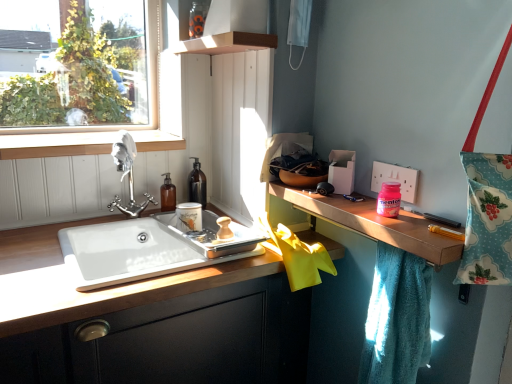
Where is `wooden at right`? The image size is (512, 384). wooden at right is located at coordinates (375, 224).

Where is `teal soft towel at right`? Image resolution: width=512 pixels, height=384 pixels. teal soft towel at right is located at coordinates [x=397, y=319].

Find the location of a particular element. This screenshot has height=384, width=512. brown glass pump bottle at upper left, the second toiletry positioned from the right is located at coordinates (167, 194).

Find the location of a particular element. This screenshot has width=512, height=384. black glass bottle at upper center is located at coordinates (197, 184).

Describe the element at coordinates (389, 199) in the screenshot. The width and height of the screenshot is (512, 384). I see `pink glossy mentos at upper right, the first toiletry from the front` at that location.

The image size is (512, 384). Identify the location of pink glossy mentos at upper right, the first toiletry from the front. (389, 199).

You are a GUI agent. You are given a task and a screenshot of the screen. Output one action in this format:
    pyautogui.click(x=<x>, y=<y>)
    Task: Click on the wooden at left
    The width and height of the screenshot is (512, 384).
    Given the screenshot: What is the action you would take?
    tap(55, 145)

From a real-world perspective, is brown glass pump bottle at upper left, the second toiletry positioned from the right, beneath pink glossy mentos at upper right, the first toiletry from the front?

Indeed, from a real-world perspective, brown glass pump bottle at upper left, the second toiletry positioned from the right, is positioned beneath pink glossy mentos at upper right, the first toiletry from the front.

What's the angular difference between brown glass pump bottle at upper left, the first toiletry in the back-to-front sequence, and pink glossy mentos at upper right, which appears as the second toiletry when viewed from the left,'s facing directions?

brown glass pump bottle at upper left, the first toiletry in the back-to-front sequence, and pink glossy mentos at upper right, which appears as the second toiletry when viewed from the left, are facing 85.3 degrees away from each other.

Is pink glossy mentos at upper right, the first toiletry from the front, completely or partially inside brown glass pump bottle at upper left, which is counted as the second toiletry, starting from the front?

No, brown glass pump bottle at upper left, which is counted as the second toiletry, starting from the front, does not contain pink glossy mentos at upper right, the first toiletry from the front.

Which is in front, point (162, 204) or point (399, 184)?

Positioned in front is point (399, 184).

Do you think wooden at left is within black glass bottle at upper center, or outside of it?

wooden at left lies outside black glass bottle at upper center.

In terms of size, does wooden at left appear bigger or smaller than black glass bottle at upper center?

wooden at left is bigger than black glass bottle at upper center.

From the image's perspective, which is below, wooden at left or black glass bottle at upper center?

black glass bottle at upper center appears lower in the image.

Which is in front, wooden at left or black glass bottle at upper center?

wooden at left is in front.

Considering the relative sizes of floral fabric tote bag at right and brown glass pump bottle at upper left, the second toiletry positioned from the right, in the image provided, is floral fabric tote bag at right wider than brown glass pump bottle at upper left, the second toiletry positioned from the right,?

Yes, floral fabric tote bag at right is wider than brown glass pump bottle at upper left, the second toiletry positioned from the right.

From a real-world perspective, starting from the floral fabric tote bag at right, which toiletry is the 2nd one below it? Please provide its 2D coordinates.

[(167, 194)]

Considering the relative positions of floral fabric tote bag at right and brown glass pump bottle at upper left, the first toiletry in the back-to-front sequence, in the image provided, is floral fabric tote bag at right to the right of brown glass pump bottle at upper left, the first toiletry in the back-to-front sequence, from the viewer's perspective?

Yes, floral fabric tote bag at right is to the right of brown glass pump bottle at upper left, the first toiletry in the back-to-front sequence.

Can you confirm if floral fabric tote bag at right is taller than brown glass pump bottle at upper left, the first toiletry in the back-to-front sequence?

Yes.

Considering the positions of objects black glass bottle at upper center and teal soft towel at right in the image provided, who is in front, black glass bottle at upper center or teal soft towel at right?

teal soft towel at right.

Identify the location of bath towel to the right of black glass bottle at upper center. The image size is (512, 384). (397, 319).

Could teal soft towel at right be considered to be inside black glass bottle at upper center?

No, teal soft towel at right is located outside of black glass bottle at upper center.

From the image's perspective, is black glass bottle at upper center on top of teal soft towel at right?

Indeed, from the image's perspective, black glass bottle at upper center is shown above teal soft towel at right.

This screenshot has height=384, width=512. I want to click on toiletry above the black glass bottle at upper center (from a real-world perspective), so click(x=389, y=199).

Considering the positions of objects pink glossy mentos at upper right, the second toiletry when ordered from back to front, and black glass bottle at upper center in the image provided, who is more to the left, pink glossy mentos at upper right, the second toiletry when ordered from back to front, or black glass bottle at upper center?

Positioned to the left is black glass bottle at upper center.

Is the surface of pink glossy mentos at upper right, the second toiletry when ordered from back to front, in direct contact with black glass bottle at upper center?

No, pink glossy mentos at upper right, the second toiletry when ordered from back to front, is not beside black glass bottle at upper center.

Between pink glossy mentos at upper right, the first toiletry from the front, and black glass bottle at upper center, which one has more height?

Standing taller between the two is black glass bottle at upper center.

In the image, is wooden cabinet at lower left positioned in front of or behind wooden at right?

wooden cabinet at lower left is in front of wooden at right.

From the image's perspective, which is below, wooden cabinet at lower left or wooden at right?

wooden cabinet at lower left is shown below in the image.

Is wooden cabinet at lower left in contact with wooden at right?

No, wooden cabinet at lower left is not beside wooden at right.

Could you tell me if wooden cabinet at lower left is turned towards wooden at right?

No, wooden cabinet at lower left is not facing towards wooden at right.

Is point (164, 197) closer or farther from the camera than point (8, 373)?

Clearly, point (164, 197) is more distant from the camera than point (8, 373).

Can you confirm if brown glass pump bottle at upper left, the first toiletry in the back-to-front sequence, is thinner than wooden cabinet at lower left?

Correct, the width of brown glass pump bottle at upper left, the first toiletry in the back-to-front sequence, is less than that of wooden cabinet at lower left.

Is brown glass pump bottle at upper left, the first toiletry from the left, inside or outside of wooden cabinet at lower left?

brown glass pump bottle at upper left, the first toiletry from the left, exists outside the volume of wooden cabinet at lower left.

At what (x,y) coordinates should I click in order to perform the action: click on toiletry located in front of the brown glass pump bottle at upper left, which is counted as the second toiletry, starting from the front. Please return your answer as a coordinate pair (x, y). Looking at the image, I should click on (389, 199).

There is a black glass bottle at upper center. Where is `window sill above it (from a real-world perspective)`? window sill above it (from a real-world perspective) is located at coordinates (55, 145).

Looking at the image, which one is located further to wooden cabinet at lower left, wooden at left or teal soft towel at right?

wooden at left lies further to wooden cabinet at lower left than the other object.

Estimate the real-world distances between objects in this image. Which object is closer to pink glossy mentos at upper right, which appears as the second toiletry when viewed from the left, brown glass pump bottle at upper left, the first toiletry in the back-to-front sequence, or wooden at right?

wooden at right is closer to pink glossy mentos at upper right, which appears as the second toiletry when viewed from the left.

Looking at the image, which one is located further to wooden at left, brown glass pump bottle at upper left, the first toiletry in the back-to-front sequence, or pink glossy mentos at upper right, the first toiletry from the front?

pink glossy mentos at upper right, the first toiletry from the front, lies further to wooden at left than the other object.

From the image, which object appears to be farther from wooden at left, wooden at right or teal soft towel at right?

teal soft towel at right is further to wooden at left.

Looking at the image, which one is located closer to wooden cabinet at lower left, teal soft towel at right or black glass bottle at upper center?

The object closer to wooden cabinet at lower left is teal soft towel at right.

Looking at the image, which one is located further to wooden at right, pink glossy mentos at upper right, the first toiletry from the front, or wooden at left?

Based on the image, wooden at left appears to be further to wooden at right.

Which object lies nearer to the anchor point black glass bottle at upper center, pink glossy mentos at upper right, which appears as the second toiletry when viewed from the left, or wooden cabinet at lower left?

The object closer to black glass bottle at upper center is wooden cabinet at lower left.

From the picture: Looking at the image, which one is located closer to wooden at left, teal soft towel at right or wooden cabinet at lower left?

wooden cabinet at lower left is closer to wooden at left.

Image resolution: width=512 pixels, height=384 pixels. What are the coordinates of `bottle located between wooden at left and pink glossy mentos at upper right, which appears as the second toiletry when viewed from the left, in the left-right direction` in the screenshot? It's located at (197, 184).

This screenshot has height=384, width=512. Identify the location of countertop located between wooden at left and teal soft towel at right in the left-right direction. (375, 224).

Where is `bottle between wooden at left and wooden cabinet at lower left in the up-down direction`? bottle between wooden at left and wooden cabinet at lower left in the up-down direction is located at coordinates (197, 184).

You are a GUI agent. You are given a task and a screenshot of the screen. Output one action in this format:
    pyautogui.click(x=<x>, y=<y>)
    Task: Click on the countertop between floral fabric tote bag at right and teal soft towel at right vertically
    The height and width of the screenshot is (384, 512).
    Given the screenshot: What is the action you would take?
    pyautogui.click(x=375, y=224)